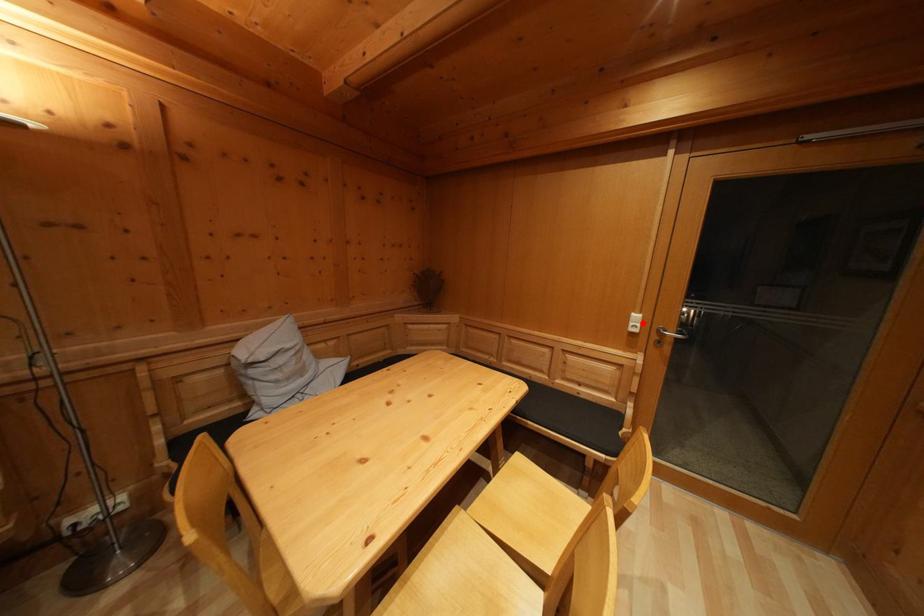
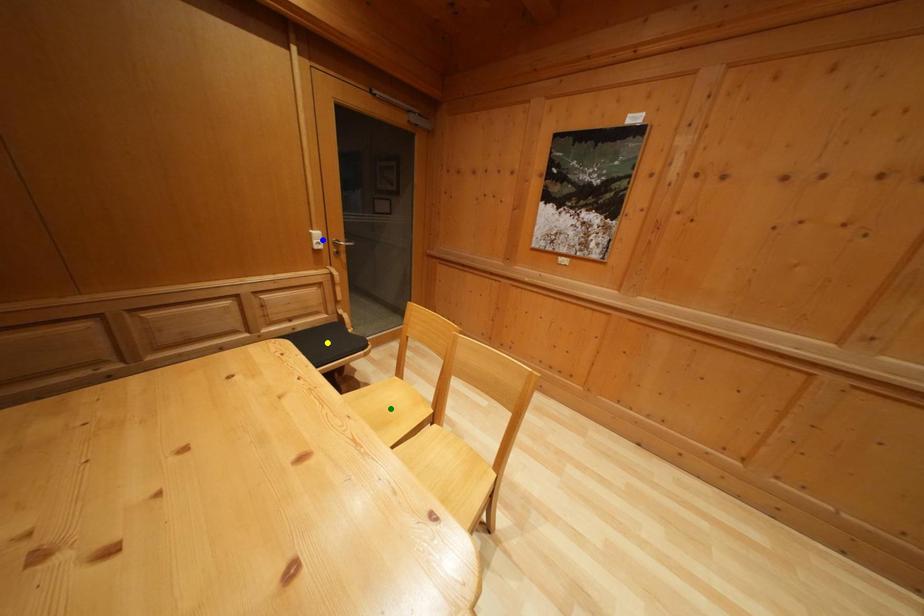
Question: I am providing you with two images of the same scene from different viewpoints. A red point is marked on the first image. You are given multiple points on the second image. Can you choose the point in image 2 that corresponds to the point in image 1?

Choices:
 (A) blue point
 (B) green point
 (C) yellow point

Answer: (A)